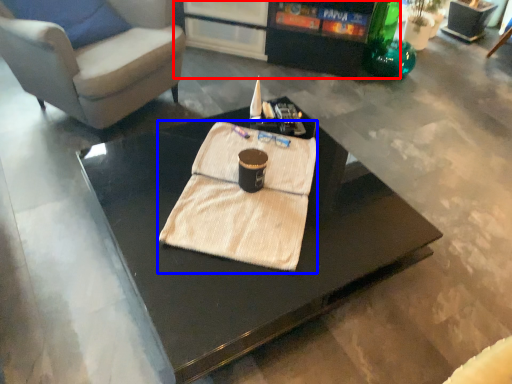
Question: Which point is further to the camera, entertainment center (highlighted by a red box) or blanket (highlighted by a blue box)?

Choices:
 (A) entertainment center
 (B) blanket

Answer: (A)